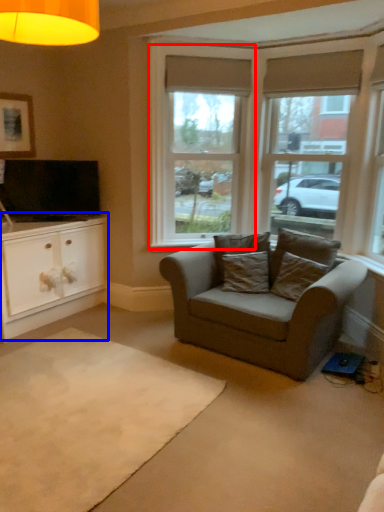
Question: Which object is closer to the camera taking this photo, window (highlighted by a red box) or cabinetry (highlighted by a blue box)?

Choices:
 (A) window
 (B) cabinetry

Answer: (B)